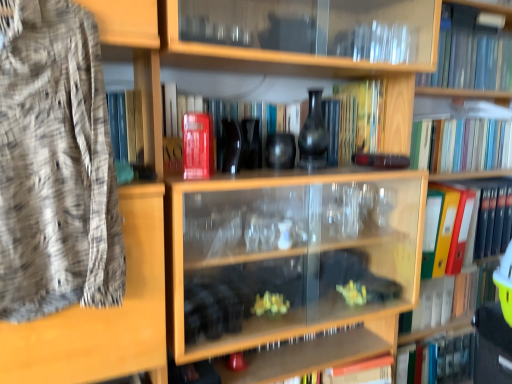
At what (x,y) coordinates should I click in order to perform the action: click on free space above orange file folder at right, which ranks as the 6th book in top-to-bottom order (from a real-world perspective). Please return your answer as a coordinate pair (x, y). Looking at the image, I should click on (489, 181).